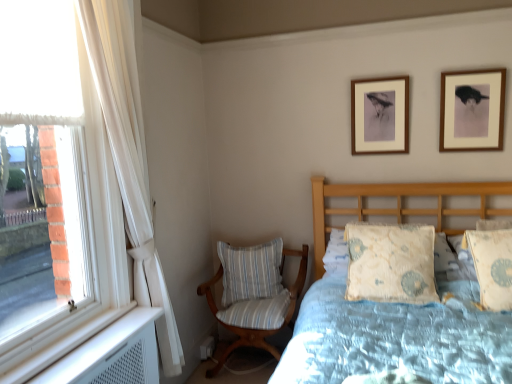
This screenshot has height=384, width=512. Describe the element at coordinates (492, 266) in the screenshot. I see `light blue floral fabric pillow at right, the 3th pillow from the back` at that location.

Image resolution: width=512 pixels, height=384 pixels. Identify the location of wooden picture frame at upper center, the 1th picture frame in the back-to-front sequence. (380, 115).

This screenshot has height=384, width=512. I want to click on striped fabric chair at lower left, so click(x=254, y=295).

Which object is positioned more to the right, white sheer curtain at left or wooden picture frame at upper center, marked as the second picture frame in a right-to-left arrangement?

From the viewer's perspective, wooden picture frame at upper center, marked as the second picture frame in a right-to-left arrangement, appears more on the right side.

From a real-world perspective, is white sheer curtain at left positioned over wooden picture frame at upper center, the 2th picture frame from the front, based on gravity?

Actually, white sheer curtain at left is physically below wooden picture frame at upper center, the 2th picture frame from the front, in the real world.

Based on the photo, is white sheer curtain at left directly adjacent to wooden picture frame at upper center, which is counted as the first picture frame, starting from the left?

No, white sheer curtain at left is not next to wooden picture frame at upper center, which is counted as the first picture frame, starting from the left.

Which is more distant, (137,227) or (381,90)?

The point (381,90) is farther.

Considering the sizes of light blue floral pillow at center, the 2th pillow when ordered from right to left, and white sheer curtain at left in the image, is light blue floral pillow at center, the 2th pillow when ordered from right to left, taller or shorter than white sheer curtain at left?

Considering their sizes, light blue floral pillow at center, the 2th pillow when ordered from right to left, has less height than white sheer curtain at left.

Between light blue floral pillow at center, the 2th pillow when ordered from right to left, and white sheer curtain at left, which one has smaller width?

white sheer curtain at left.

From the image's perspective, is light blue floral pillow at center, positioned as the 2th pillow in back-to-front order, under white sheer curtain at left?

Indeed, from the image's perspective, light blue floral pillow at center, positioned as the 2th pillow in back-to-front order, is shown beneath white sheer curtain at left.

From the image's perspective, which pillow is the 2nd one below the white sheer curtain at left? Please provide its 2D coordinates.

[(391, 263)]

Identify the location of chair below the wooden picture frame at upper center, the 2th picture frame from the front (from the image's perspective). (254, 295).

From the image's perspective, is wooden picture frame at upper center, marked as the second picture frame in a right-to-left arrangement, over striped fabric chair at lower left?

Correct, wooden picture frame at upper center, marked as the second picture frame in a right-to-left arrangement, appears higher than striped fabric chair at lower left in the image.

Consider the image. Is wooden picture frame at upper center, the 2th picture frame from the front, further to camera compared to striped fabric chair at lower left?

Yes, wooden picture frame at upper center, the 2th picture frame from the front, is further from the camera.

Which of these two, wooden picture frame at upper center, which is counted as the first picture frame, starting from the left, or striped fabric chair at lower left, is wider?

striped fabric chair at lower left is wider.

From a real-world perspective, does white sheer curtain at left stand above light blue floral fabric pillow at right, the first pillow from the front?

Yes, from a real-world perspective, white sheer curtain at left is over light blue floral fabric pillow at right, the first pillow from the front

Considering the relative sizes of white sheer curtain at left and light blue floral fabric pillow at right, the 3th pillow from the back, in the image provided, is white sheer curtain at left thinner than light blue floral fabric pillow at right, the 3th pillow from the back,?

Correct, the width of white sheer curtain at left is less than that of light blue floral fabric pillow at right, the 3th pillow from the back.

Is white sheer curtain at left to the left or to the right of light blue floral fabric pillow at right, placed as the 3th pillow when sorted from left to right, in the image?

Based on their positions, white sheer curtain at left is located to the left of light blue floral fabric pillow at right, placed as the 3th pillow when sorted from left to right.

From the image's perspective, would you say striped fabric chair at lower left is positioned over light blue floral pillow at center, positioned as the 2th pillow in back-to-front order?

No, from the image's perspective, striped fabric chair at lower left is not over light blue floral pillow at center, positioned as the 2th pillow in back-to-front order.

Could you measure the distance between striped fabric chair at lower left and light blue floral pillow at center, the second pillow in the left-to-right sequence?

striped fabric chair at lower left and light blue floral pillow at center, the second pillow in the left-to-right sequence, are 30.96 inches apart from each other.

Between striped fabric chair at lower left and light blue floral pillow at center, the second pillow in the left-to-right sequence, which one has larger width?

striped fabric chair at lower left is wider.

Considering the relative sizes of striped fabric chair at lower left and light blue floral pillow at center, positioned as the 2th pillow in back-to-front order, in the image provided, is striped fabric chair at lower left shorter than light blue floral pillow at center, positioned as the 2th pillow in back-to-front order,?

No, striped fabric chair at lower left is not shorter than light blue floral pillow at center, positioned as the 2th pillow in back-to-front order.

Considering the relative sizes of light blue floral fabric pillow at right, the first pillow from the front, and wooden picture frame at upper center, which is counted as the first picture frame, starting from the left, in the image provided, is light blue floral fabric pillow at right, the first pillow from the front, shorter than wooden picture frame at upper center, which is counted as the first picture frame, starting from the left,?

In fact, light blue floral fabric pillow at right, the first pillow from the front, may be taller than wooden picture frame at upper center, which is counted as the first picture frame, starting from the left.

Is light blue floral fabric pillow at right, the 3th pillow from the back, facing away from wooden picture frame at upper center, the 2th picture frame from the front?

No, light blue floral fabric pillow at right, the 3th pillow from the back,'s orientation is not away from wooden picture frame at upper center, the 2th picture frame from the front.

Does light blue floral fabric pillow at right, the 3th pillow from the back, appear on the left side of white striped cushion at center, which appears as the third pillow when viewed from the right?

Incorrect, light blue floral fabric pillow at right, the 3th pillow from the back, is not on the left side of white striped cushion at center, which appears as the third pillow when viewed from the right.

Can you confirm if light blue floral fabric pillow at right, the first pillow from the front, is thinner than white striped cushion at center, the third pillow viewed from the front?

No.

Looking at this image, from the image's perspective, is light blue floral fabric pillow at right, the first pillow from the front, below white striped cushion at center, which appears as the third pillow when viewed from the right?

Incorrect, from the image's perspective, light blue floral fabric pillow at right, the first pillow from the front, is higher than white striped cushion at center, which appears as the third pillow when viewed from the right.

You are a GUI agent. You are given a task and a screenshot of the screen. Output one action in this format:
    pyautogui.click(x=<x>, y=<y>)
    Task: Click on the 2nd picture frame directly above the white sheer curtain at left (from a real-world perspective)
    Image resolution: width=512 pixels, height=384 pixels.
    Given the screenshot: What is the action you would take?
    pyautogui.click(x=380, y=115)

This screenshot has width=512, height=384. Find the location of `curtain that is above the light blue floral pillow at center, positioned as the second pillow in front-to-back order (from the image's perspective)`. curtain that is above the light blue floral pillow at center, positioned as the second pillow in front-to-back order (from the image's perspective) is located at coordinates (129, 148).

Based on their spatial positions, is white sheer curtain at left or light blue floral pillow at center, positioned as the 2th pillow in back-to-front order, closer to light blue floral fabric pillow at right, the 3th pillow from the back?

The object closer to light blue floral fabric pillow at right, the 3th pillow from the back, is light blue floral pillow at center, positioned as the 2th pillow in back-to-front order.

Looking at the image, which one is located closer to wooden picture frame at upper right, which appears as the 1th picture frame when viewed from the right, light blue floral pillow at center, positioned as the second pillow in front-to-back order, or wooden picture frame at upper center, marked as the second picture frame in a right-to-left arrangement?

wooden picture frame at upper center, marked as the second picture frame in a right-to-left arrangement, is positioned closer to the anchor wooden picture frame at upper right, which appears as the 1th picture frame when viewed from the right.

Considering their positions, is wooden picture frame at upper center, the 2th picture frame from the front, positioned further to striped fabric chair at lower left than light blue floral fabric pillow at right, placed as the 3th pillow when sorted from left to right?

light blue floral fabric pillow at right, placed as the 3th pillow when sorted from left to right, is further to striped fabric chair at lower left.

Based on their spatial positions, is white sheer curtain at left or white striped cushion at center, which is the first pillow in left-to-right order, further from striped fabric chair at lower left?

Among the two, white sheer curtain at left is located further to striped fabric chair at lower left.

Estimate the real-world distances between objects in this image. Which object is closer to light blue floral pillow at center, positioned as the 2th pillow in back-to-front order, white sheer curtain at left or wooden picture frame at upper center, the 2th picture frame from the front?

Based on the image, wooden picture frame at upper center, the 2th picture frame from the front, appears to be nearer to light blue floral pillow at center, positioned as the 2th pillow in back-to-front order.

Which object lies nearer to the anchor point striped fabric chair at lower left, white sheer curtain at left or wooden picture frame at upper right, which ranks as the first picture frame in front-to-back order?

white sheer curtain at left.

Based on their spatial positions, is striped fabric chair at lower left or light blue floral fabric pillow at right, the 1th pillow from the right, closer to wooden picture frame at upper right, which is counted as the 2th picture frame, starting from the back?

light blue floral fabric pillow at right, the 1th pillow from the right, is positioned closer to the anchor wooden picture frame at upper right, which is counted as the 2th picture frame, starting from the back.

When comparing their distances from white sheer curtain at left, does light blue floral pillow at center, positioned as the 2th pillow in back-to-front order, or striped fabric chair at lower left seem closer?

striped fabric chair at lower left is closer to white sheer curtain at left.

Where is `chair between white sheer curtain at left and light blue floral pillow at center, positioned as the second pillow in front-to-back order`? This screenshot has height=384, width=512. chair between white sheer curtain at left and light blue floral pillow at center, positioned as the second pillow in front-to-back order is located at coordinates (254, 295).

You are a GUI agent. You are given a task and a screenshot of the screen. Output one action in this format:
    pyautogui.click(x=<x>, y=<y>)
    Task: Click on the picture frame located between white sheer curtain at left and light blue floral fabric pillow at right, the 1th pillow from the right, in the left-right direction
    
    Given the screenshot: What is the action you would take?
    pyautogui.click(x=380, y=115)

At what (x,y) coordinates should I click in order to perform the action: click on chair between white striped cushion at center, which is the first pillow in left-to-right order, and light blue floral fabric pillow at right, the 3th pillow from the back. Please return your answer as a coordinate pair (x, y). The image size is (512, 384). Looking at the image, I should click on (254, 295).

Locate an element on the screen. Image resolution: width=512 pixels, height=384 pixels. picture frame between wooden picture frame at upper center, the 2th picture frame from the front, and light blue floral fabric pillow at right, the 3th pillow from the back, in the up-down direction is located at coordinates (472, 110).